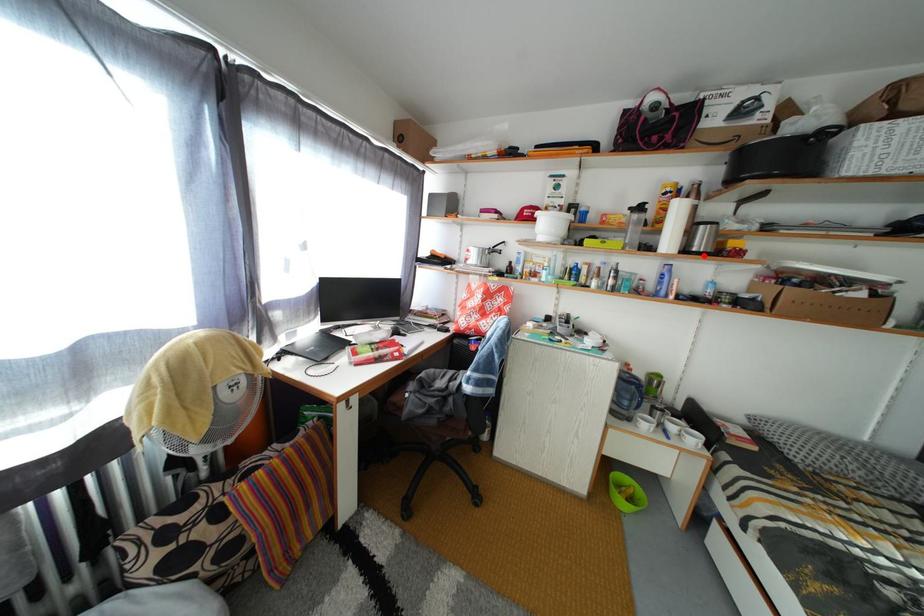
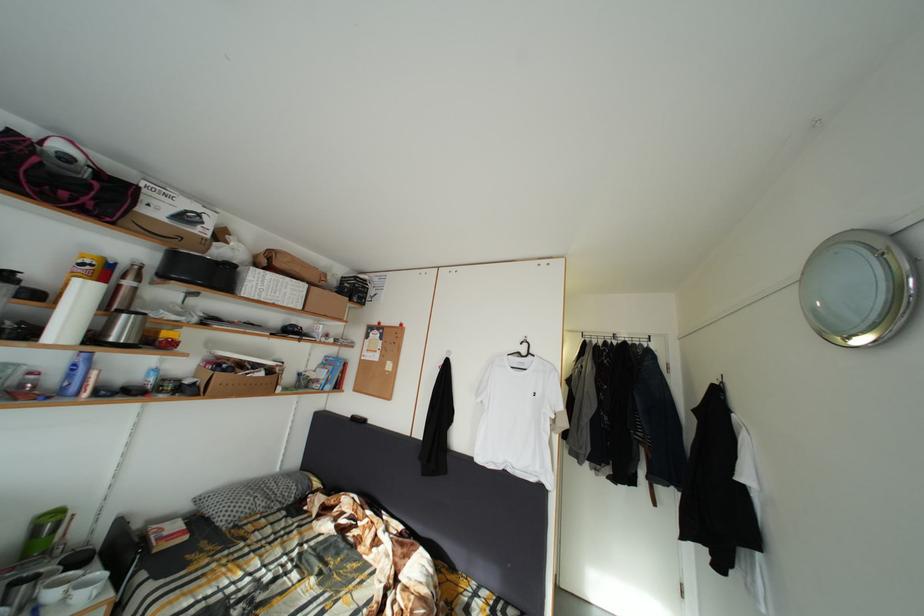
Where in the second image is the point corresponding to the highlighted location from the first image?

(120, 345)